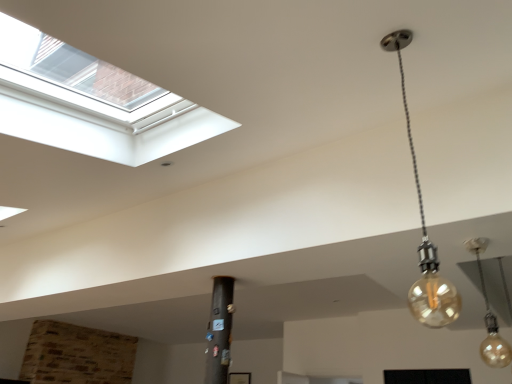
What do you see at coordinates (424, 232) in the screenshot? I see `translucent amber bulb at upper right, marked as the second lamp in a bottom-to-top arrangement` at bounding box center [424, 232].

Find the location of a particular element. The width and height of the screenshot is (512, 384). translucent amber bulb at upper right, which ranks as the 2th lamp in back-to-front order is located at coordinates (424, 232).

What is the approximate width of translucent amber bulb at upper right, the first lamp viewed from the left?

It is 5.65 inches.

What do you see at coordinates (489, 317) in the screenshot?
I see `translucent glass bulb at lower right, acting as the 1th lamp starting from the right` at bounding box center [489, 317].

From the picture: How much space does translucent glass bulb at lower right, marked as the second lamp in a front-to-back arrangement, occupy vertically?

translucent glass bulb at lower right, marked as the second lamp in a front-to-back arrangement, is 20.73 inches tall.

This screenshot has width=512, height=384. I want to click on translucent glass bulb at lower right, the first lamp in the back-to-front sequence, so click(489, 317).

This screenshot has width=512, height=384. In order to click on translucent amber bulb at upper right, the first lamp viewed from the left in this screenshot , I will do `click(424, 232)`.

Considering the relative positions of translucent glass bulb at lower right, acting as the 1th lamp starting from the right, and translucent amber bulb at upper right, which ranks as the 2th lamp in back-to-front order, in the image provided, is translucent glass bulb at lower right, acting as the 1th lamp starting from the right, to the right of translucent amber bulb at upper right, which ranks as the 2th lamp in back-to-front order, from the viewer's perspective?

Correct, you'll find translucent glass bulb at lower right, acting as the 1th lamp starting from the right, to the right of translucent amber bulb at upper right, which ranks as the 2th lamp in back-to-front order.

Is translucent glass bulb at lower right, which is the 2th lamp in top-to-bottom order, closer to the viewer compared to translucent amber bulb at upper right, the second lamp when ordered from right to left?

No, translucent glass bulb at lower right, which is the 2th lamp in top-to-bottom order, is further to the viewer.

Does point (478, 245) lie behind point (424, 290)?

That is True.

From the image's perspective, which is above, translucent glass bulb at lower right, which is the 2th lamp in top-to-bottom order, or translucent amber bulb at upper right, the first lamp when ordered from top to bottom?

translucent amber bulb at upper right, the first lamp when ordered from top to bottom, is shown above in the image.

From a real-world perspective, does translucent glass bulb at lower right, which is the second lamp from left to right, stand above translucent amber bulb at upper right, the first lamp viewed from the left?

No, from a real-world perspective, translucent glass bulb at lower right, which is the second lamp from left to right, is not above translucent amber bulb at upper right, the first lamp viewed from the left.

Is translucent glass bulb at lower right, the first lamp in the back-to-front sequence, wider or thinner than translucent amber bulb at upper right, which ranks as the 2th lamp in back-to-front order?

translucent glass bulb at lower right, the first lamp in the back-to-front sequence, is thinner than translucent amber bulb at upper right, which ranks as the 2th lamp in back-to-front order.

From their relative heights in the image, would you say translucent glass bulb at lower right, marked as the second lamp in a front-to-back arrangement, is taller or shorter than translucent amber bulb at upper right, the first lamp viewed from the left?

Clearly, translucent glass bulb at lower right, marked as the second lamp in a front-to-back arrangement, is shorter compared to translucent amber bulb at upper right, the first lamp viewed from the left.

Does translucent glass bulb at lower right, acting as the 1th lamp starting from the right, have a smaller size compared to translucent amber bulb at upper right, which ranks as the 2th lamp in back-to-front order?

Correct, translucent glass bulb at lower right, acting as the 1th lamp starting from the right, occupies less space than translucent amber bulb at upper right, which ranks as the 2th lamp in back-to-front order.

Does translucent glass bulb at lower right, acting as the 1th lamp starting from the right, contain translucent amber bulb at upper right, the second lamp when ordered from right to left?

Definitely not — translucent amber bulb at upper right, the second lamp when ordered from right to left, is not inside translucent glass bulb at lower right, acting as the 1th lamp starting from the right.

Would you consider translucent glass bulb at lower right, which is the first lamp in bottom-to-top order, to be distant from translucent amber bulb at upper right, marked as the first lamp in a front-to-back arrangement?

Yes, translucent glass bulb at lower right, which is the first lamp in bottom-to-top order, and translucent amber bulb at upper right, marked as the first lamp in a front-to-back arrangement, are located far from each other.

Is translucent glass bulb at lower right, acting as the 1th lamp starting from the right, facing away from translucent amber bulb at upper right, marked as the first lamp in a front-to-back arrangement?

translucent glass bulb at lower right, acting as the 1th lamp starting from the right, is not turned away from translucent amber bulb at upper right, marked as the first lamp in a front-to-back arrangement.

This screenshot has height=384, width=512. Identify the location of lamp located above the translucent glass bulb at lower right, marked as the second lamp in a front-to-back arrangement (from the image's perspective). (424, 232).

Visually, is translucent amber bulb at upper right, the first lamp when ordered from top to bottom, positioned to the left or to the right of translucent glass bulb at lower right, marked as the second lamp in a front-to-back arrangement?

Clearly, translucent amber bulb at upper right, the first lamp when ordered from top to bottom, is on the left of translucent glass bulb at lower right, marked as the second lamp in a front-to-back arrangement, in the image.

Relative to translucent glass bulb at lower right, acting as the 1th lamp starting from the right, is translucent amber bulb at upper right, the first lamp viewed from the left, in front or behind?

In the image, translucent amber bulb at upper right, the first lamp viewed from the left, appears in front of translucent glass bulb at lower right, acting as the 1th lamp starting from the right.

Is point (426, 268) positioned after point (502, 349)?

No, it is not.

From the image's perspective, does translucent amber bulb at upper right, which ranks as the 2th lamp in back-to-front order, appear higher than translucent glass bulb at lower right, marked as the second lamp in a front-to-back arrangement?

Yes, from the image's perspective, translucent amber bulb at upper right, which ranks as the 2th lamp in back-to-front order, is above translucent glass bulb at lower right, marked as the second lamp in a front-to-back arrangement.

From a real-world perspective, which object rests below the other?

translucent glass bulb at lower right, the first lamp in the back-to-front sequence.

In terms of width, does translucent amber bulb at upper right, the second lamp when ordered from right to left, look wider or thinner when compared to translucent glass bulb at lower right, marked as the second lamp in a front-to-back arrangement?

Clearly, translucent amber bulb at upper right, the second lamp when ordered from right to left, has more width compared to translucent glass bulb at lower right, marked as the second lamp in a front-to-back arrangement.

Is translucent amber bulb at upper right, the first lamp viewed from the left, taller or shorter than translucent glass bulb at lower right, acting as the 1th lamp starting from the right?

Clearly, translucent amber bulb at upper right, the first lamp viewed from the left, is taller compared to translucent glass bulb at lower right, acting as the 1th lamp starting from the right.

Does translucent amber bulb at upper right, the first lamp when ordered from top to bottom, have a smaller size compared to translucent glass bulb at lower right, which is the first lamp in bottom-to-top order?

Incorrect, translucent amber bulb at upper right, the first lamp when ordered from top to bottom, is not smaller in size than translucent glass bulb at lower right, which is the first lamp in bottom-to-top order.

Do you think translucent amber bulb at upper right, the second lamp when ordered from right to left, is within translucent glass bulb at lower right, marked as the second lamp in a front-to-back arrangement, or outside of it?

The correct answer is: outside.

Is translucent amber bulb at upper right, which ranks as the 2th lamp in back-to-front order, with translucent glass bulb at lower right, which is the first lamp in bottom-to-top order?

No.

Is translucent amber bulb at upper right, marked as the first lamp in a front-to-back arrangement, facing away from translucent glass bulb at lower right, which is the first lamp in bottom-to-top order?

translucent amber bulb at upper right, marked as the first lamp in a front-to-back arrangement, does not have its back to translucent glass bulb at lower right, which is the first lamp in bottom-to-top order.

Can you tell me how much translucent amber bulb at upper right, marked as the second lamp in a bottom-to-top arrangement, and translucent glass bulb at lower right, which is the second lamp from left to right, differ in facing direction?

translucent amber bulb at upper right, marked as the second lamp in a bottom-to-top arrangement, and translucent glass bulb at lower right, which is the second lamp from left to right, are facing 178 degrees away from each other.

Measure the distance from translucent amber bulb at upper right, the first lamp when ordered from top to bottom, to translucent glass bulb at lower right, acting as the 1th lamp starting from the right.

translucent amber bulb at upper right, the first lamp when ordered from top to bottom, is 3.06 meters from translucent glass bulb at lower right, acting as the 1th lamp starting from the right.

This screenshot has height=384, width=512. I want to click on lamp that appears on the left of translucent glass bulb at lower right, acting as the 1th lamp starting from the right, so click(x=424, y=232).

At what (x,y) coordinates should I click in order to perform the action: click on lamp lying above the translucent glass bulb at lower right, which is the first lamp in bottom-to-top order (from the image's perspective). Please return your answer as a coordinate pair (x, y). This screenshot has width=512, height=384. Looking at the image, I should click on (424, 232).

Where is `lamp lying behind the translucent amber bulb at upper right, marked as the first lamp in a front-to-back arrangement`? This screenshot has width=512, height=384. lamp lying behind the translucent amber bulb at upper right, marked as the first lamp in a front-to-back arrangement is located at coordinates (489, 317).